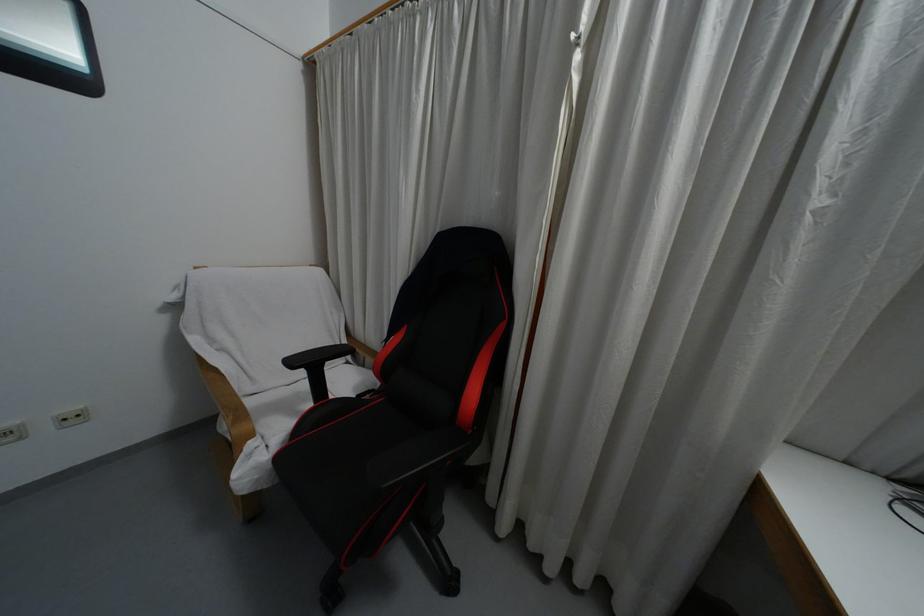
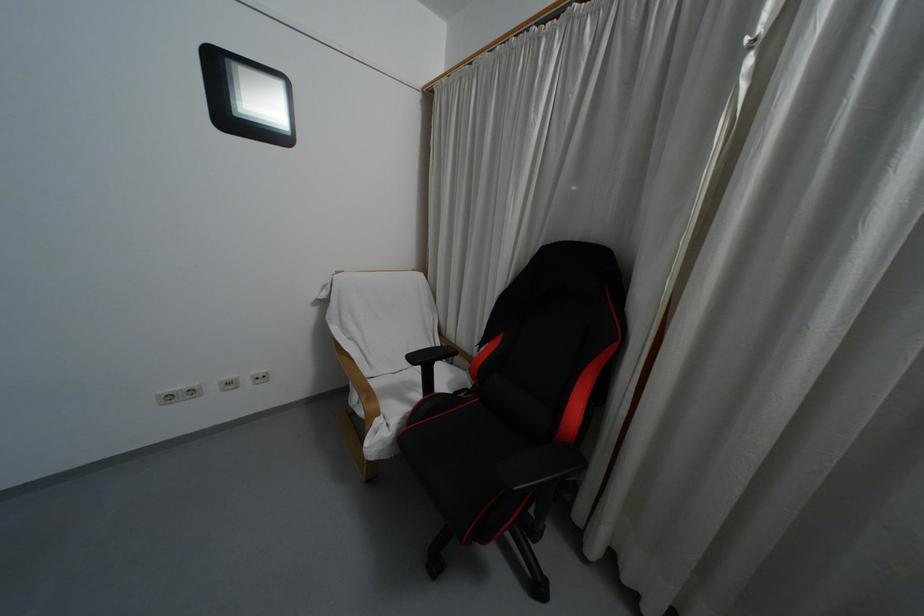
The images are taken continuously from a first-person perspective. In which direction are you moving?

The movement direction of the cameraman is left, backward.